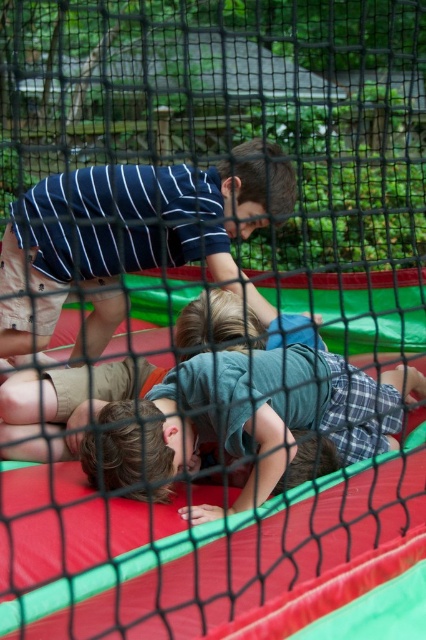
Question: Which point is closer to the camera?

Choices:
 (A) (160, 436)
 (B) (222, 168)

Answer: (A)

Question: Is green cotton shirt at center to the left of striped cotton shirt at upper center from the viewer's perspective?

Choices:
 (A) yes
 (B) no

Answer: (B)

Question: In this image, where is green cotton shirt at center located relative to striped cotton shirt at upper center?

Choices:
 (A) left
 (B) right

Answer: (B)

Question: Which point is farther from the camera taking this photo?

Choices:
 (A) (242, 221)
 (B) (126, 493)

Answer: (A)

Question: Considering the relative positions of green cotton shirt at center and striped cotton shirt at upper center in the image provided, where is green cotton shirt at center located with respect to striped cotton shirt at upper center?

Choices:
 (A) right
 (B) left

Answer: (A)